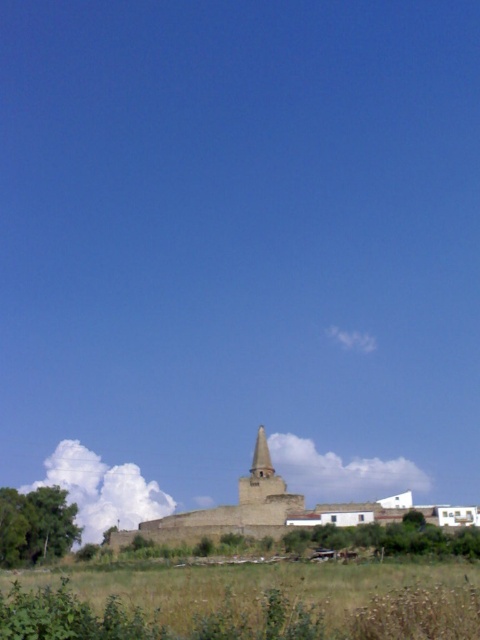
You are standing in the middle of the green grassy field at lower center and want to walk towards the smooth stone tower at center. Which direction should you head?

Since the green grassy field at lower center is to the right of the smooth stone tower at center, you should head to the left to reach the tower.

You are standing at the point marked as point (299, 596) in the image. Looking around, you see the historic stone structure with a conical roof. Which direction should you walk to reach the green grassy field at lower center?

The point (299, 596) is already located at the green grassy field at lower center, so you are already there.